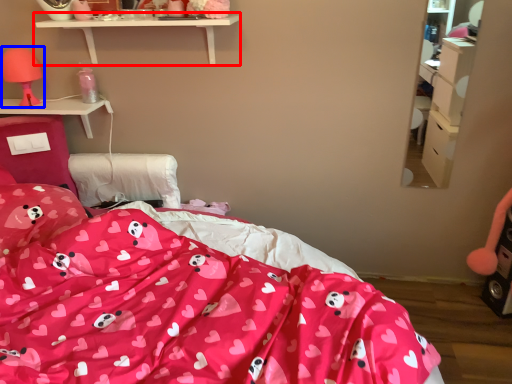
Question: Which point is closer to the camera, shelf (highlighted by a red box) or table lamp (highlighted by a blue box)?

Choices:
 (A) shelf
 (B) table lamp

Answer: (A)